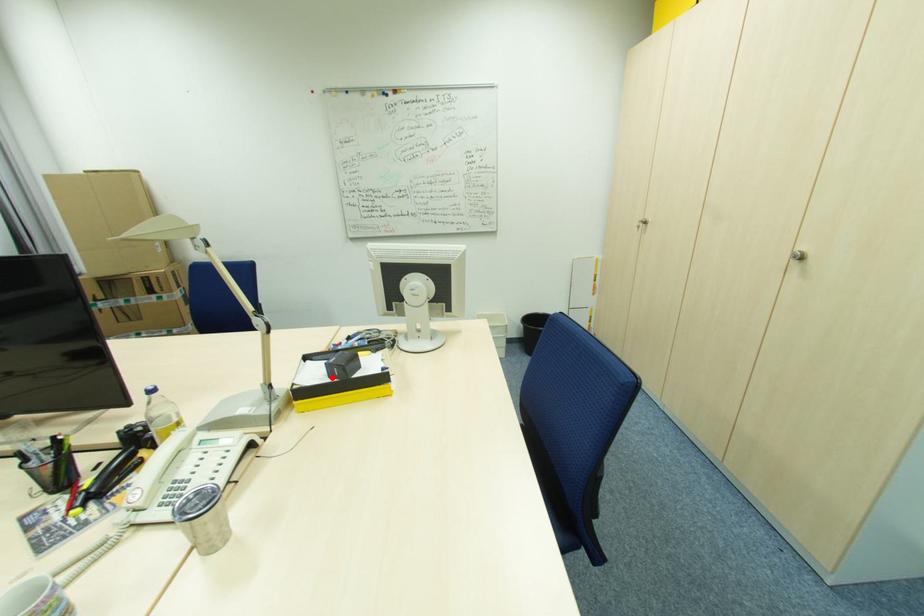
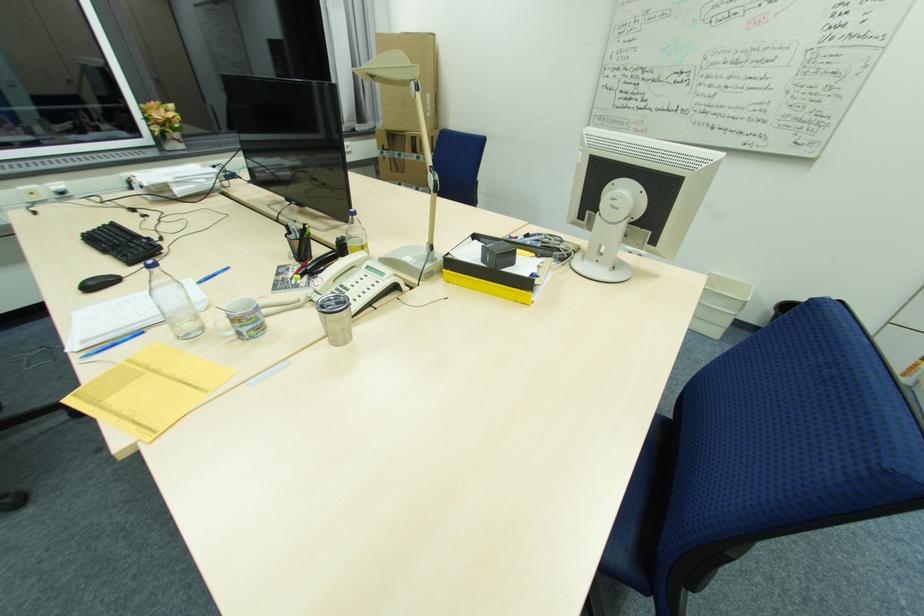
Where in the second image is the point corresponding to the highlighted location from the first image?

(484, 262)